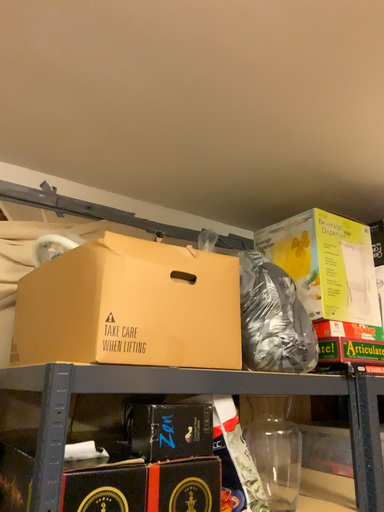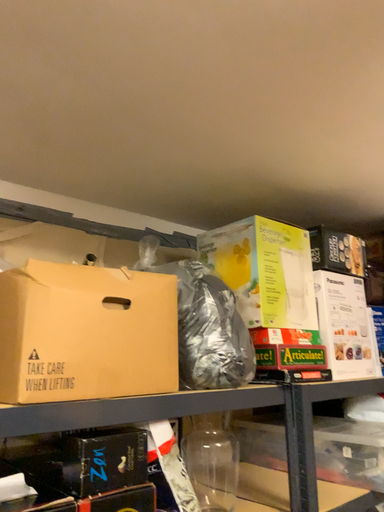
Question: Which way did the camera rotate in the video?

Choices:
 (A) rotated left
 (B) rotated right

Answer: (B)